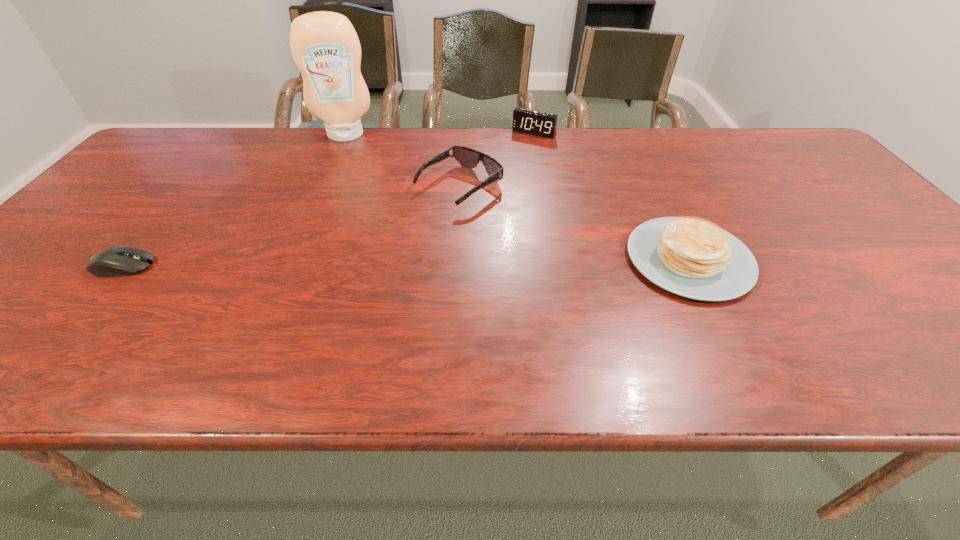
Find the location of `computer mouse`. computer mouse is located at coordinates pos(116,261).

At what (x,y) coordinates should I click in order to perform the action: click on the shortest object. Please return your answer as a coordinate pair (x, y). This screenshot has height=540, width=960. Looking at the image, I should click on (116, 261).

You are a GUI agent. You are given a task and a screenshot of the screen. Output one action in this format:
    pyautogui.click(x=<x>, y=<y>)
    Task: Click on the rightmost object
    The height and width of the screenshot is (540, 960).
    Given the screenshot: What is the action you would take?
    pyautogui.click(x=692, y=257)

Image resolution: width=960 pixels, height=540 pixels. I want to click on the third object from right to left, so click(467, 157).

Find the location of `the third nearest object`. the third nearest object is located at coordinates (467, 157).

Find the location of `the tallest object`. the tallest object is located at coordinates (324, 45).

Find the location of a particular element. The width and height of the screenshot is (960, 540). condiment is located at coordinates (324, 45).

Locate an element on the screen. the second object from right to left is located at coordinates (542, 124).

Locate an element on the screen. vacant point located on the wheel side of the shortest object is located at coordinates [312, 266].

At what (x,y) coordinates should I click in order to perform the action: click on vacant space situated 0.340m on the right of the pancake. Please return your answer as a coordinate pair (x, y). The height and width of the screenshot is (540, 960). Looking at the image, I should click on point(901,259).